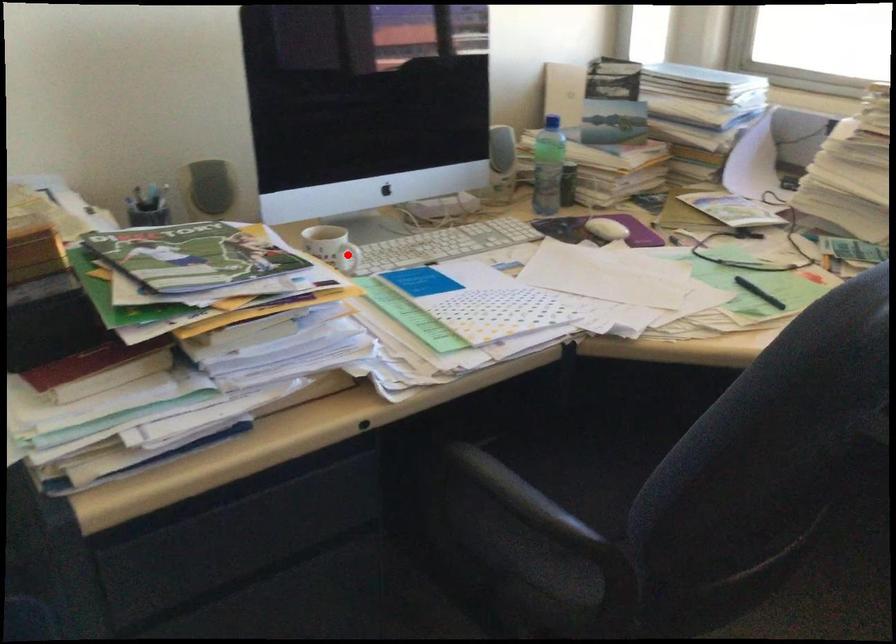
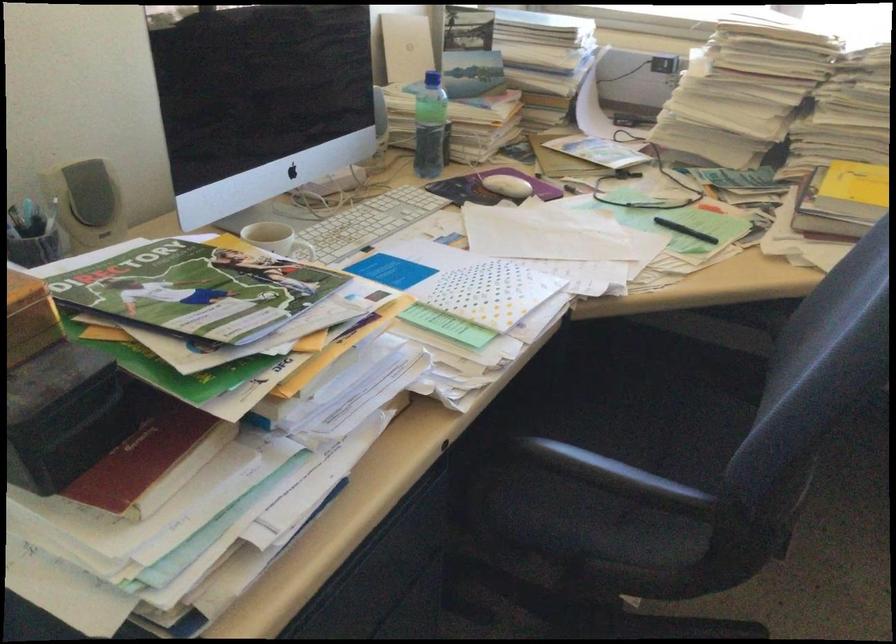
Question: I am providing you with two images of the same scene from different viewpoints. A red point is shown in image1. For the corresponding object point in image2, is it positioned nearer or farther from the camera?

Choices:
 (A) Nearer
 (B) Farther

Answer: (A)